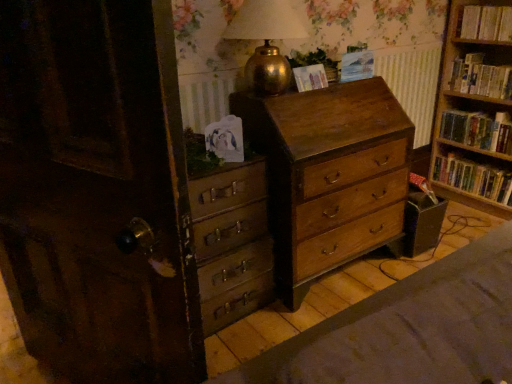
Question: From the image's perspective, is hardcover books at upper right, acting as the 1th book starting from the top, located above or below hardcover book at right, placed as the third book when sorted from top to bottom?

Choices:
 (A) above
 (B) below

Answer: (A)

Question: Is point (465, 23) closer or farther from the camera than point (508, 117)?

Choices:
 (A) farther
 (B) closer

Answer: (A)

Question: Estimate the real-world distances between objects in this image. Which object is closer to the blue paper at upper center, which is counted as the 1th paperback book, starting from the right?

Choices:
 (A) matte paper at upper center, which is the first paperback book from left to right
 (B) wooden chest of drawers at center, the 2th chest of drawers positioned from the left
 (C) wooden bookshelf at right, the first book when ordered from bottom to top
 (D) hardcover book at right, positioned as the 2th book in bottom-to-top order
 (E) hardcover books at upper right, acting as the 1th book starting from the top

Answer: (A)

Question: Based on their relative distances, which object is farther from the matte paper at upper center, which is the first paperback book from left to right?

Choices:
 (A) wooden chest of drawers at center, which is the second chest of drawers in right-to-left order
 (B) hardcover books at right, placed as the 3th book when sorted from bottom to top
 (C) blue paper at upper center, which is the second paperback book in left-to-right order
 (D) wooden chest of drawers at center, the 2th chest of drawers positioned from the left
 (E) wooden bookshelf at right, the fourth book from the top

Answer: (E)